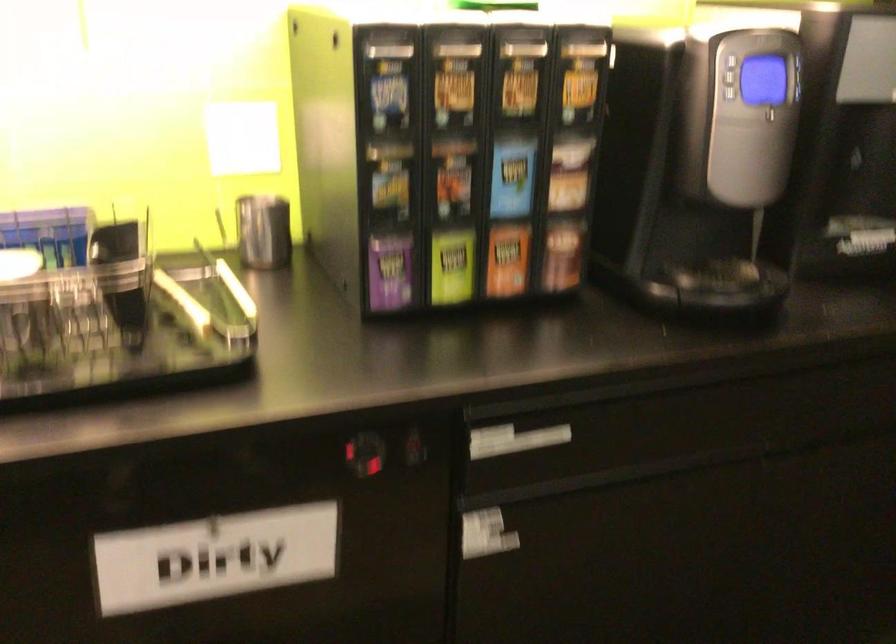
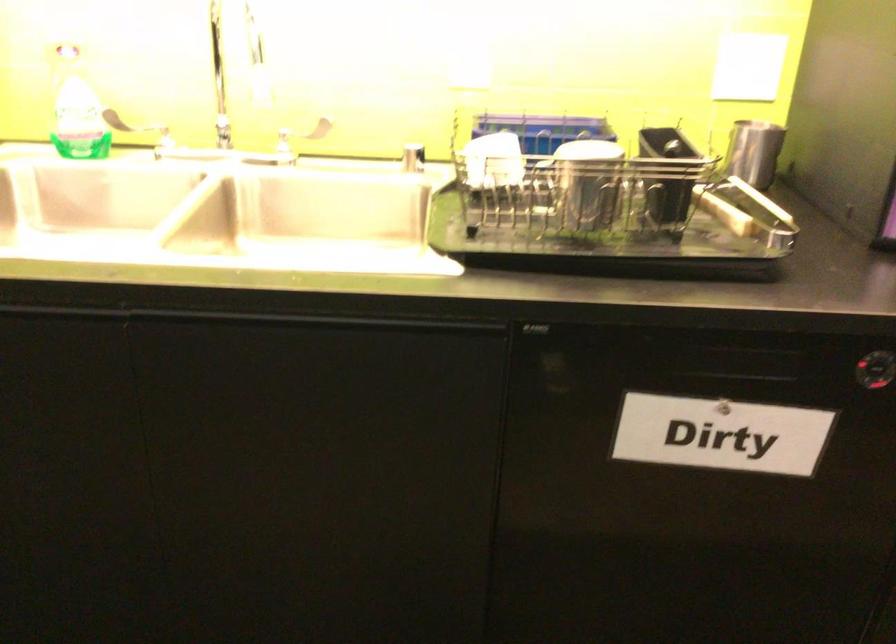
What movement of the cameraman would produce the second image?

The movement direction of the cameraman is left, backward.